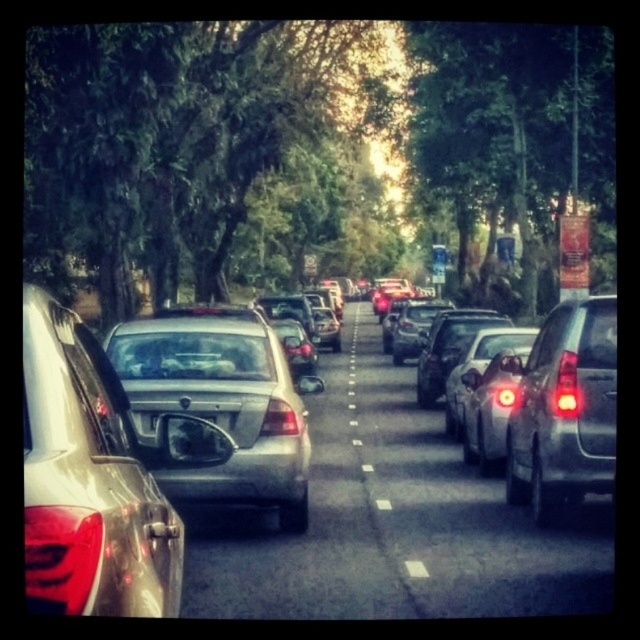
Question: Which point is farther from the camera taking this photo?

Choices:
 (A) (115, 499)
 (B) (228, 435)
 (C) (588, 394)
 (D) (256, 378)

Answer: (D)

Question: Among these objects, which one is farthest from the camera?

Choices:
 (A) white dotted lines at center
 (B) satin gold sedan at left

Answer: (A)

Question: Does satin gold sedan at left appear on the left side of black matte license plate at center?

Choices:
 (A) no
 (B) yes

Answer: (A)

Question: Is matte black suv at right above black matte license plate at center?

Choices:
 (A) no
 (B) yes

Answer: (A)

Question: Does satin gold sedan at left have a smaller size compared to white dotted lines at center?

Choices:
 (A) yes
 (B) no

Answer: (A)

Question: Which point is closer to the camera?

Choices:
 (A) white dotted lines at center
 (B) matte black car at right

Answer: (A)